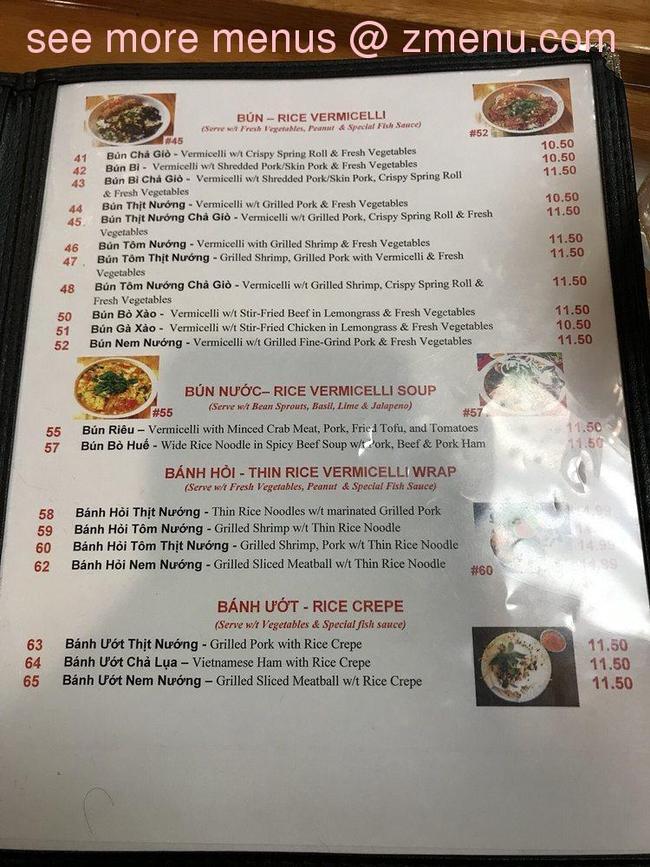
Find the location of a particular element. tabletop is located at coordinates (536, 11).